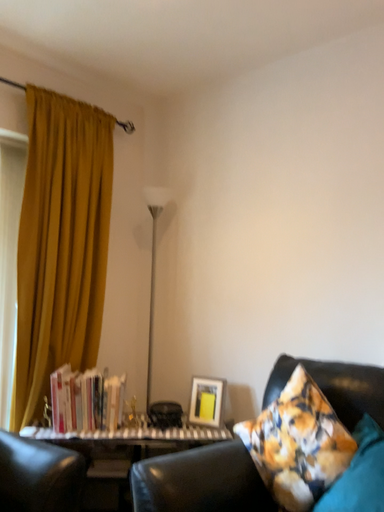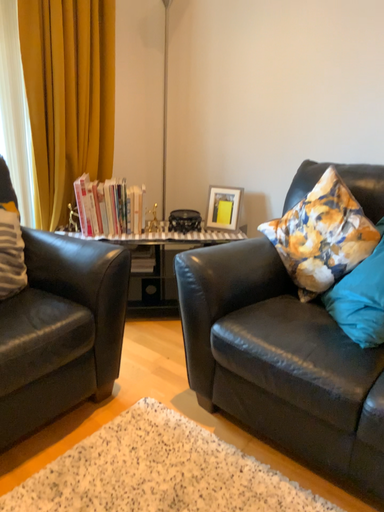
Question: How did the camera likely rotate when shooting the video?

Choices:
 (A) rotated upward
 (B) rotated downward

Answer: (B)